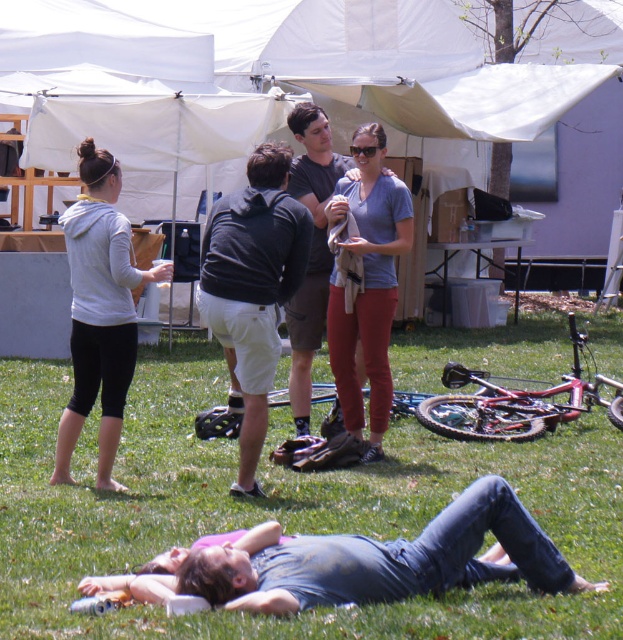
You are planning to place a small picnic basket on the clear plastic sunglasses at center. Based on the scene, will the green grass at lower center be able to support the basket if you put it there?

The green grass at lower center is larger in size than the clear plastic sunglasses at center. However, the sunglasses are an object meant for wearing, not for holding items. Therefore, placing a picnic basket on them may not be stable or practical. The grass can support the basket, but the sunglasses themselves are not suitable for holding items.

From the picture: You are a photographer at the event and want to capture a photo of the clear plastic sunglasses at center without the white fabric tent at upper center blocking the view. Is this possible?

The white fabric tent at upper center is above the clear plastic sunglasses at center, so it will block the view. You need to adjust your angle or position to avoid the tent.

You are a photographer trying to capture a shot of the clear plastic sunglasses at center. You notice the green grass at lower center is blocking your view. Which direction should you move to avoid the obstruction?

Move to the right to avoid the green grass at lower center blocking the clear plastic sunglasses at center since the grass is to the left of the sunglasses.